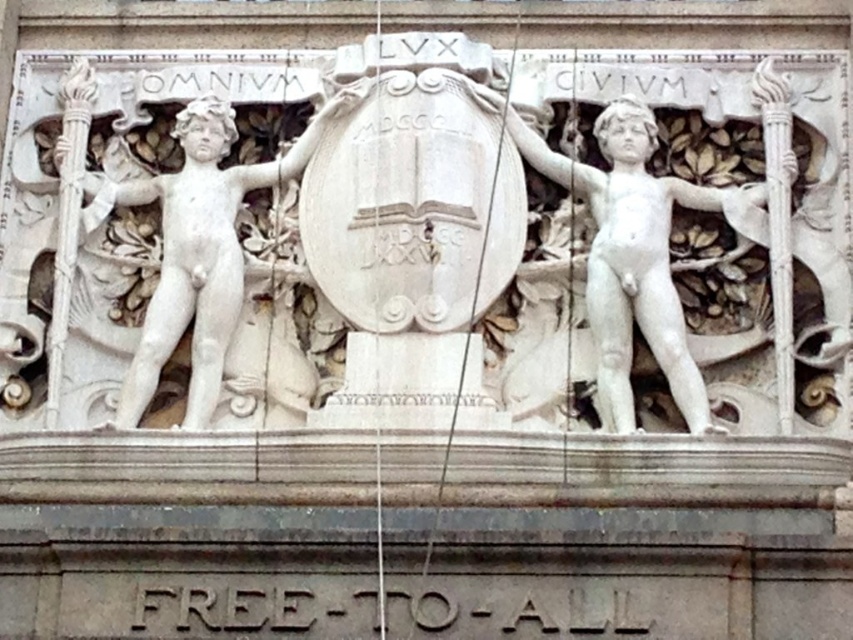
Does white marble statue at right have a greater width compared to white marble statue at left?

Correct, the width of white marble statue at right exceeds that of white marble statue at left.

The height and width of the screenshot is (640, 853). Describe the element at coordinates (630, 252) in the screenshot. I see `white marble statue at right` at that location.

Is point (660, 298) farther from camera compared to point (180, 182)?

No, (660, 298) is in front of (180, 182).

The image size is (853, 640). I want to click on white marble statue at right, so click(630, 252).